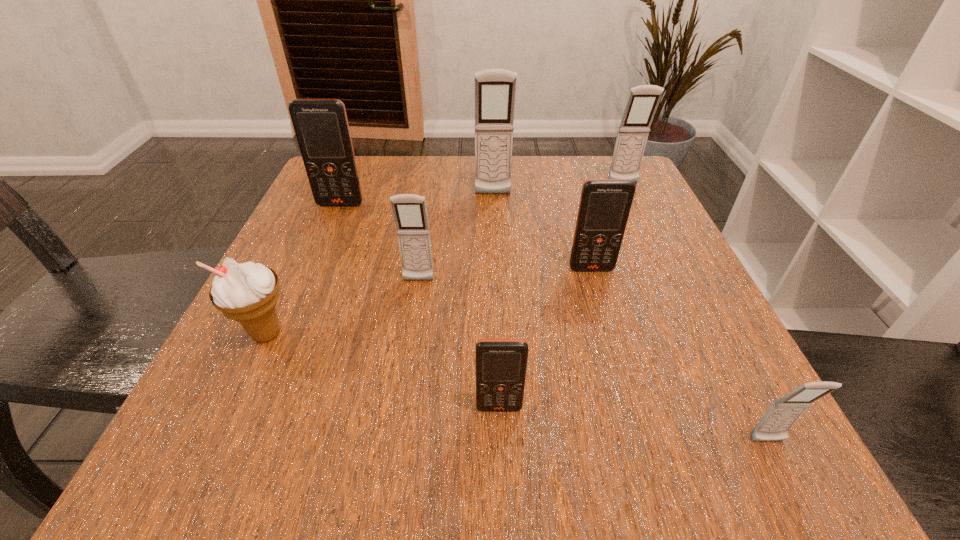
Locate an element on the screen. The height and width of the screenshot is (540, 960). the seventh nearest object is located at coordinates (495, 89).

Identify the location of the second gray cellular telephone from left to right. The width and height of the screenshot is (960, 540). (495, 89).

Locate an element on the screen. This screenshot has height=540, width=960. the third smallest gray cellular telephone is located at coordinates (643, 100).

Locate an element on the screen. the farthest cellular telephone is located at coordinates (643, 100).

The height and width of the screenshot is (540, 960). I want to click on the biggest orange cellular telephone, so click(x=321, y=126).

At what (x,y) coordinates should I click in order to perform the action: click on the leftmost cellular telephone. Please return your answer as a coordinate pair (x, y). Image resolution: width=960 pixels, height=540 pixels. Looking at the image, I should click on (321, 126).

I want to click on the second nearest gray cellular telephone, so click(x=409, y=210).

You are a GUI agent. You are given a task and a screenshot of the screen. Output one action in this format:
    pyautogui.click(x=<x>, y=<y>)
    Task: Click on the second cellular telephone from left to right
    
    Given the screenshot: What is the action you would take?
    pyautogui.click(x=409, y=210)

At what (x,y) coordinates should I click in order to perform the action: click on the fourth farthest object. Please return your answer as a coordinate pair (x, y). Looking at the image, I should click on (605, 204).

This screenshot has height=540, width=960. I want to click on the second farthest orange cellular telephone, so click(x=605, y=204).